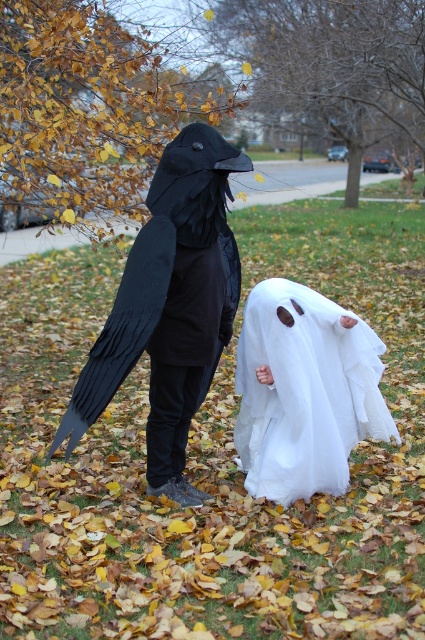
The image size is (425, 640). Describe the element at coordinates (170, 307) in the screenshot. I see `matte black bird at left` at that location.

Consider the image. Is matte black bird at left shorter than white sheer fabric ghost at lower center?

Incorrect, matte black bird at left's height does not fall short of white sheer fabric ghost at lower center's.

Between point (223, 273) and point (357, 400), which one is positioned in front?

Positioned in front is point (223, 273).

The width and height of the screenshot is (425, 640). In order to click on matte black bird at left in this screenshot , I will do `click(170, 307)`.